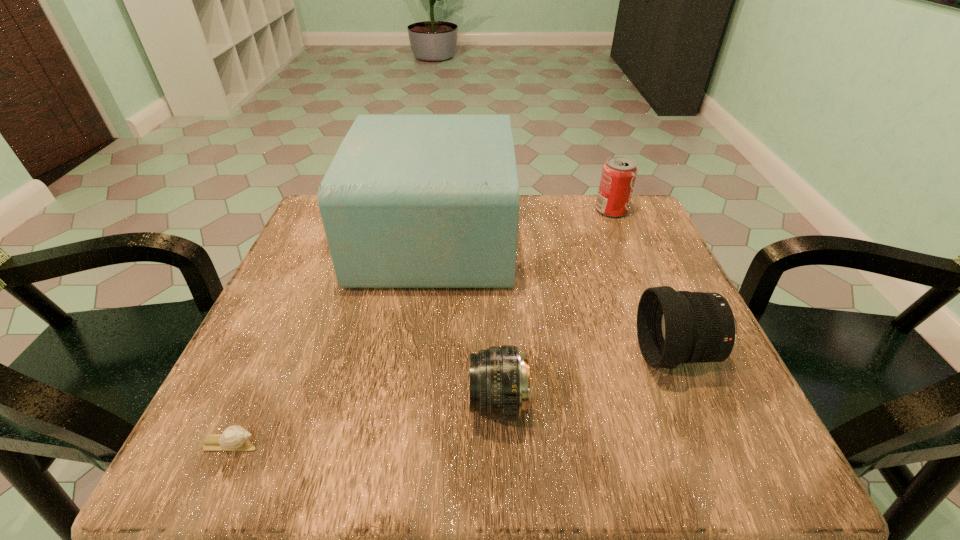
The image size is (960, 540). I want to click on vacant space that's between the shorter telephoto lens and the taller telephoto lens, so pyautogui.click(x=588, y=379).

Where is `free space between the second shortest object and the leftmost object`? free space between the second shortest object and the leftmost object is located at coordinates (364, 424).

Where is `unoccupied area between the tallest object and the leftmost object`? This screenshot has height=540, width=960. unoccupied area between the tallest object and the leftmost object is located at coordinates (333, 341).

At what (x,y) coordinates should I click in order to perform the action: click on the closest object relative to the right telephoto lens. Please return your answer as a coordinate pair (x, y). The width and height of the screenshot is (960, 540). Looking at the image, I should click on (500, 389).

Select which object is the second closest to the right telephoto lens. Please provide its 2D coordinates. Your answer should be formatted as a tuple, i.e. [(x, y)], where the tuple contains the x and y coordinates of a point satisfying the conditions above.

[(409, 201)]